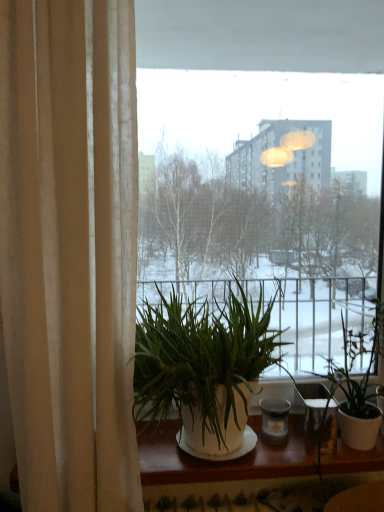
Question: Are beige fabric curtain at left and green leafy plant at right, the second houseplant from the left, making contact?

Choices:
 (A) yes
 (B) no

Answer: (B)

Question: Is beige fabric curtain at left in front of green leafy plant at right, which ranks as the first houseplant in right-to-left order?

Choices:
 (A) no
 (B) yes

Answer: (B)

Question: Can you confirm if beige fabric curtain at left is positioned to the left of green leafy plant at right, which ranks as the first houseplant in right-to-left order?

Choices:
 (A) no
 (B) yes

Answer: (B)

Question: From a real-world perspective, does beige fabric curtain at left sit lower than green leafy plant at right, which ranks as the first houseplant in right-to-left order?

Choices:
 (A) no
 (B) yes

Answer: (A)

Question: From a real-world perspective, is beige fabric curtain at left on green leafy plant at right, the second houseplant from the left?

Choices:
 (A) no
 (B) yes

Answer: (B)

Question: Is beige fabric curtain at left situated inside green leafy plant at right, the second houseplant from the left, or outside?

Choices:
 (A) inside
 (B) outside

Answer: (B)

Question: In terms of width, does beige fabric curtain at left look wider or thinner when compared to green leafy plant at right, which ranks as the first houseplant in right-to-left order?

Choices:
 (A) wide
 (B) thin

Answer: (B)

Question: Relative to green leafy plant at right, the second houseplant from the left, is beige fabric curtain at left in front or behind?

Choices:
 (A) front
 (B) behind

Answer: (A)

Question: From the image's perspective, is beige fabric curtain at left positioned above or below green leafy plant at right, which ranks as the first houseplant in right-to-left order?

Choices:
 (A) above
 (B) below

Answer: (A)

Question: Is green leafy plant at right, the second houseplant from the left, bigger or smaller than beige fabric curtain at left?

Choices:
 (A) small
 (B) big

Answer: (A)

Question: Is green leafy plant at right, which ranks as the first houseplant in right-to-left order, wider or thinner than beige fabric curtain at left?

Choices:
 (A) wide
 (B) thin

Answer: (A)

Question: Considering the positions of green leafy plant at right, the second houseplant from the left, and beige fabric curtain at left in the image, is green leafy plant at right, the second houseplant from the left, taller or shorter than beige fabric curtain at left?

Choices:
 (A) short
 (B) tall

Answer: (A)

Question: From the image's perspective, relative to beige fabric curtain at left, is green leafy plant at right, the second houseplant from the left, above or below?

Choices:
 (A) below
 (B) above

Answer: (A)

Question: Is green leafy plant at center, marked as the first houseplant in a left-to-right arrangement, wider or thinner than green leafy plant at right, which ranks as the first houseplant in right-to-left order?

Choices:
 (A) wide
 (B) thin

Answer: (A)

Question: In the image, is green leafy plant at center, marked as the first houseplant in a left-to-right arrangement, positioned in front of or behind green leafy plant at right, which ranks as the first houseplant in right-to-left order?

Choices:
 (A) front
 (B) behind

Answer: (A)